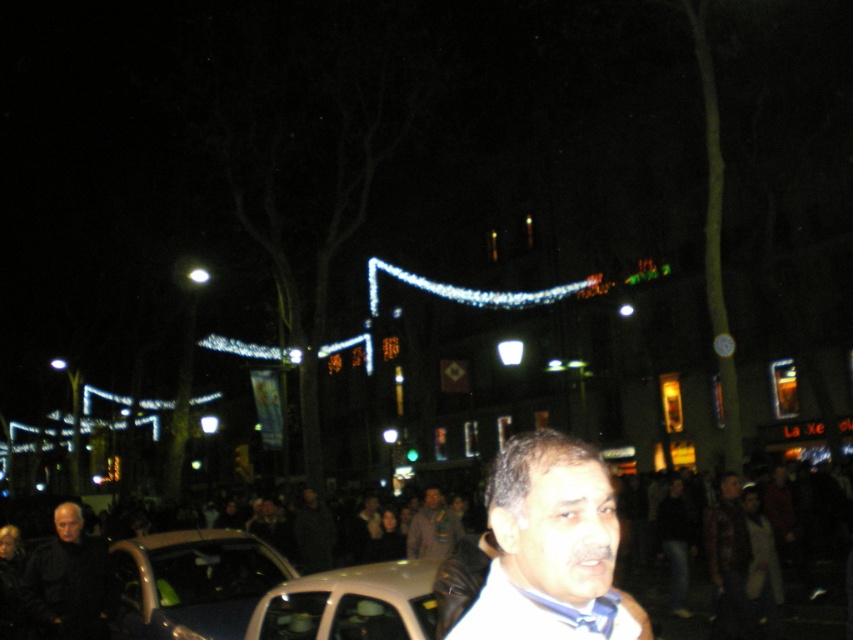
You are standing at the center of the image and want to reach the white satin shirt at lower center. What direction should you move in to get closer to it?

Since the white satin shirt at lower center is located at point 0.959 on the x axis and 0.637 on the y axis, you should move to the right and slightly downward to reach it.

You are a photographer trying to capture the festive atmosphere of the scene. You want to focus on the white satin shirt at lower center. Since you know the coordinates of the shirt, where should you aim your camera to ensure it is centered in your shot?

To center the white satin shirt at lower center in your shot, aim your camera at the coordinates point (543,612) provided in the scene description.

You are a pedestrian trying to cross the street at night. You see a metallic silver car at lower left and a dark matte jacket at lower left. Which object is closer to you?

The metallic silver car at lower left is closer to you because it is positioned over the dark matte jacket at lower left, indicating it is in front of it from your perspective.